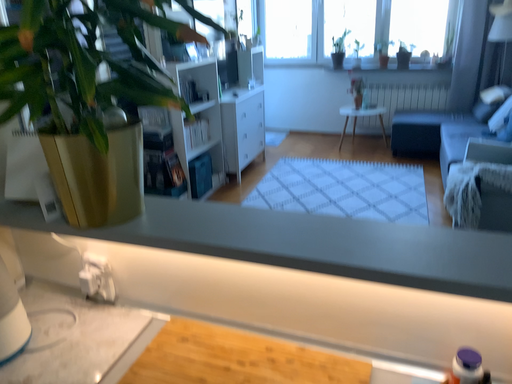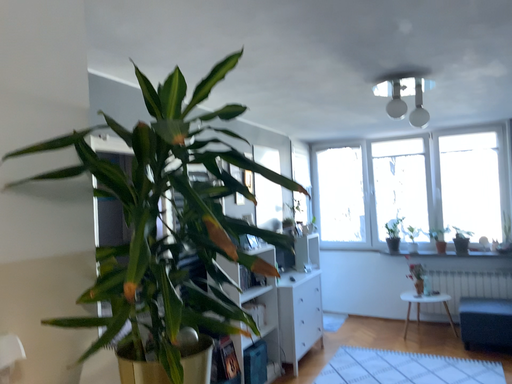
Question: Which way did the camera rotate in the video?

Choices:
 (A) rotated right
 (B) rotated left

Answer: (B)